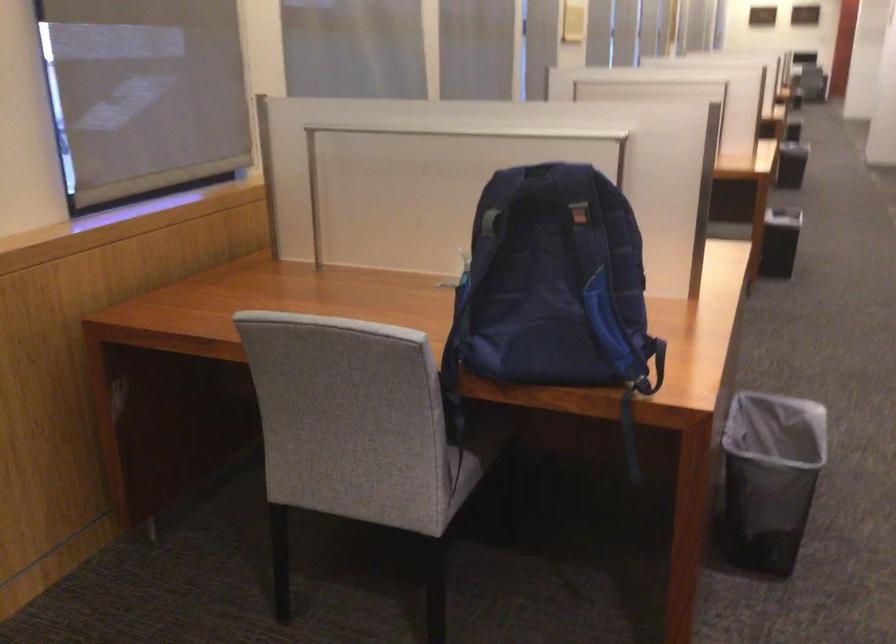
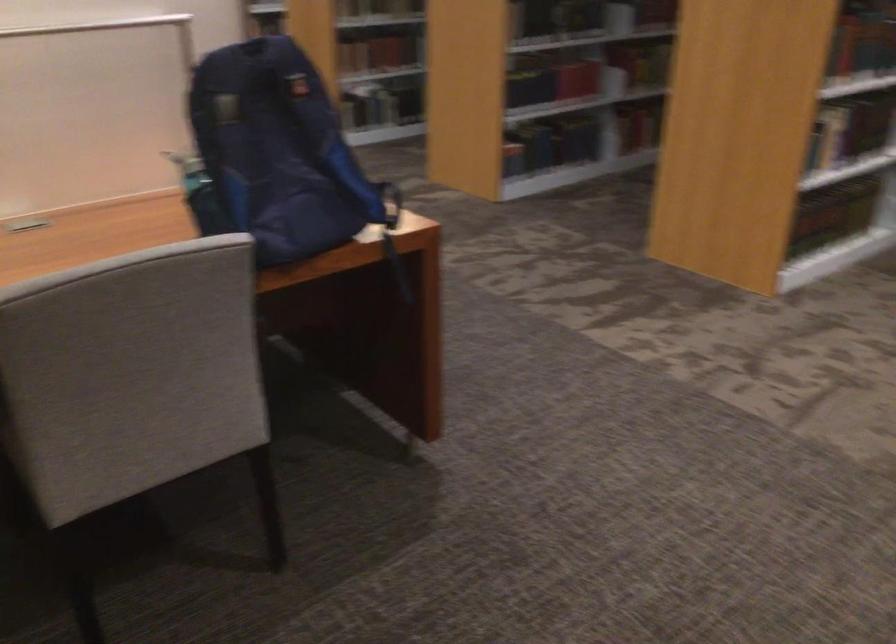
Question: I am providing you with two images of the same scene from different viewpoints. Please identify which objects are invisible in image2.

Choices:
 (A) chair sitting surface
 (B) black mesh trashcan
 (C) blue backpack strap
 (D) joystick handle

Answer: (B)